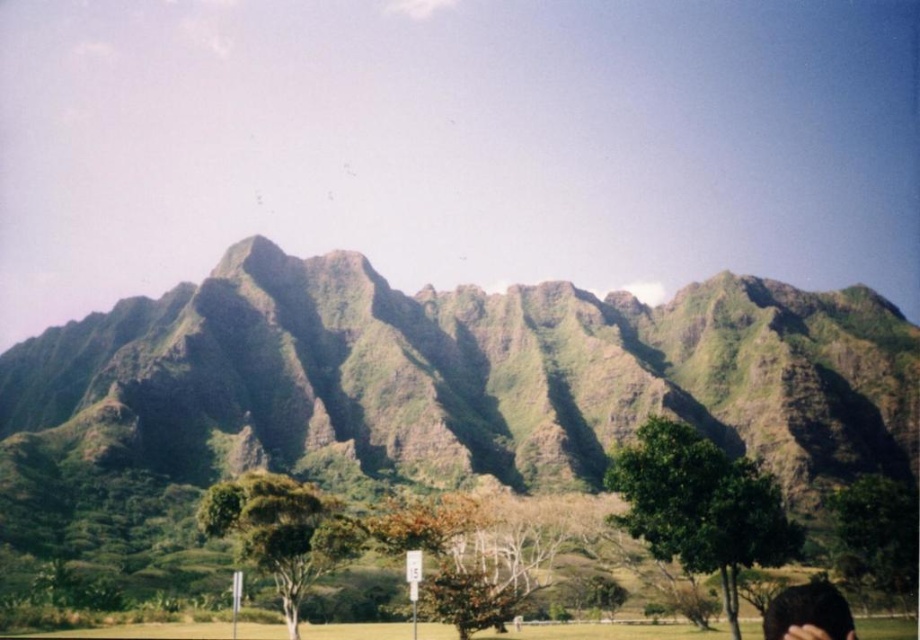
Who is higher up, green rough mountain at center or dark brown hair at lower right?

green rough mountain at center is above.

Who is shorter, green rough mountain at center or dark brown hair at lower right?

With less height is dark brown hair at lower right.

This screenshot has width=920, height=640. Describe the element at coordinates (449, 381) in the screenshot. I see `green rough mountain at center` at that location.

The height and width of the screenshot is (640, 920). I want to click on green rough mountain at center, so click(x=449, y=381).